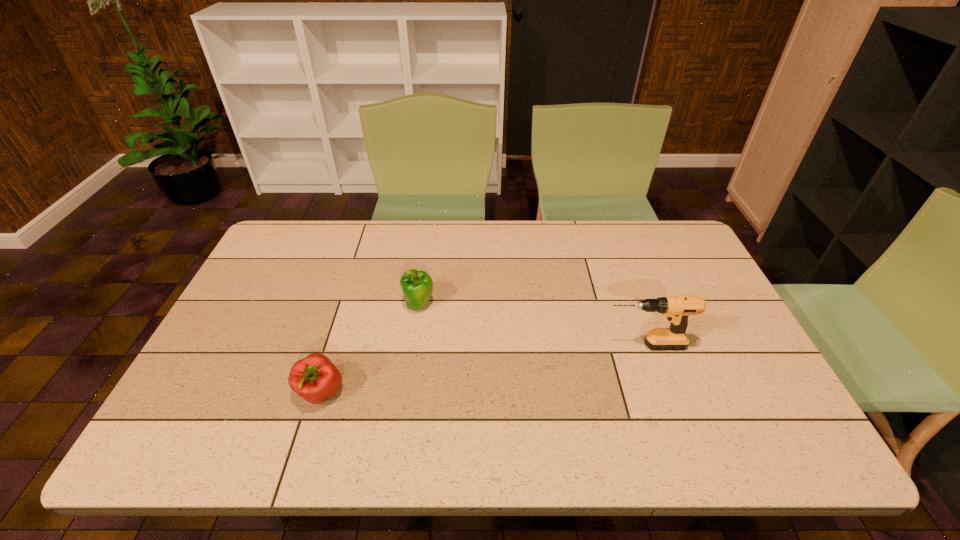
The width and height of the screenshot is (960, 540). Identify the location of vacant area that lies between the farther bell pepper and the nearest object. (370, 349).

Image resolution: width=960 pixels, height=540 pixels. I want to click on unoccupied position between the second nearest object and the shortest object, so click(x=483, y=369).

Find the location of a particular element. vacant area that lies between the nearest object and the taller bell pepper is located at coordinates (370, 349).

You are a GUI agent. You are given a task and a screenshot of the screen. Output one action in this format:
    pyautogui.click(x=<x>, y=<y>)
    Task: Click on the blank region between the shortest object and the second shortest object
    The height and width of the screenshot is (540, 960).
    Given the screenshot: What is the action you would take?
    pyautogui.click(x=370, y=349)

This screenshot has width=960, height=540. What are the coordinates of `vacant space that's between the nearest object and the drill` in the screenshot? It's located at (483, 369).

Image resolution: width=960 pixels, height=540 pixels. I want to click on free space between the nearest object and the farthest object, so click(x=370, y=349).

Locate an element on the screen. The width and height of the screenshot is (960, 540). empty space that is in between the shortest object and the second object from left to right is located at coordinates (370, 349).

Where is `free spot between the rightmost object and the leftmost object`? The width and height of the screenshot is (960, 540). free spot between the rightmost object and the leftmost object is located at coordinates (483, 369).

Image resolution: width=960 pixels, height=540 pixels. Identify the location of object that is the closest to the right bell pepper. (314, 378).

This screenshot has height=540, width=960. Find the location of `object that ranks as the closest to the rightmost object`. object that ranks as the closest to the rightmost object is located at coordinates (417, 286).